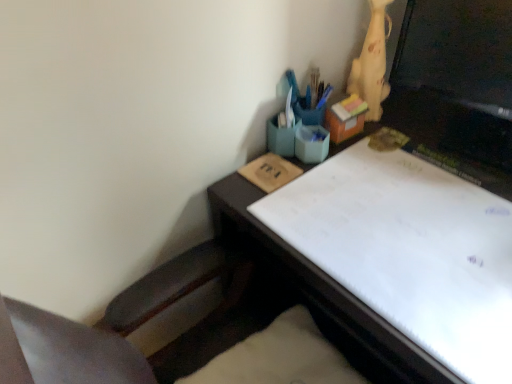
Describe the element at coordinates (458, 51) in the screenshot. I see `matte black monitor at upper right` at that location.

Locate an element on the screen. matte black monitor at upper right is located at coordinates (458, 51).

Locate an element on the screen. This screenshot has height=384, width=512. matte black monitor at upper right is located at coordinates (458, 51).